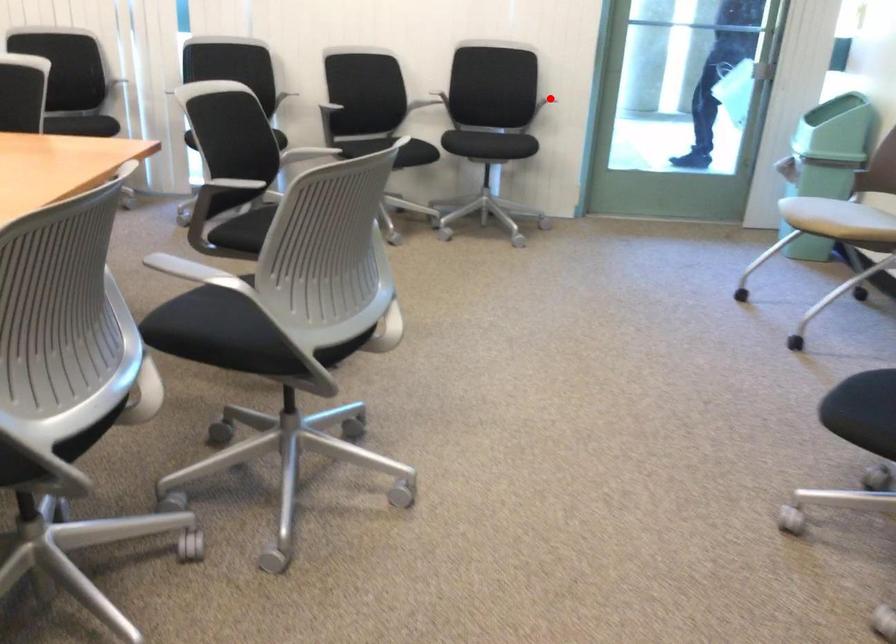
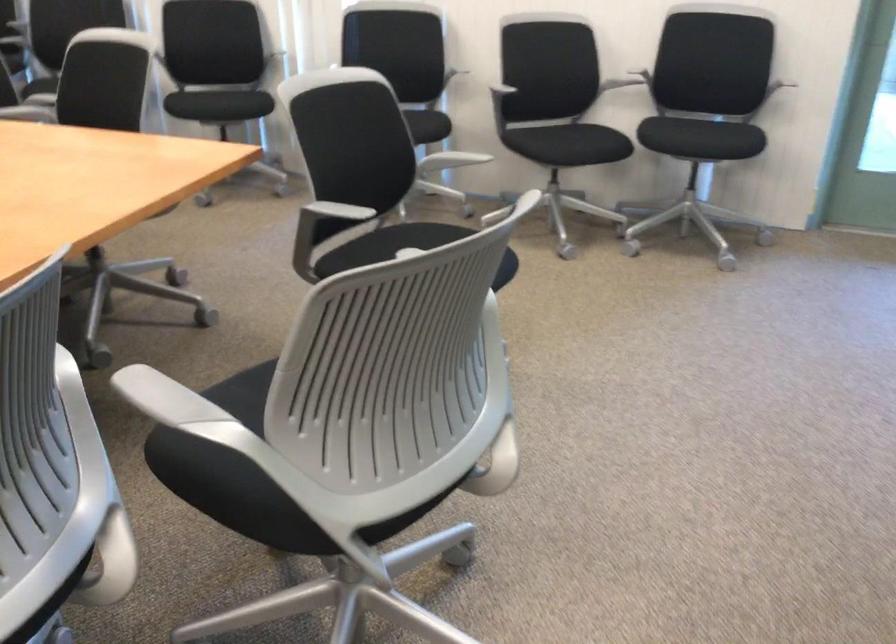
Find the pixel in the second image that matches the highlighted location in the first image.

(778, 86)